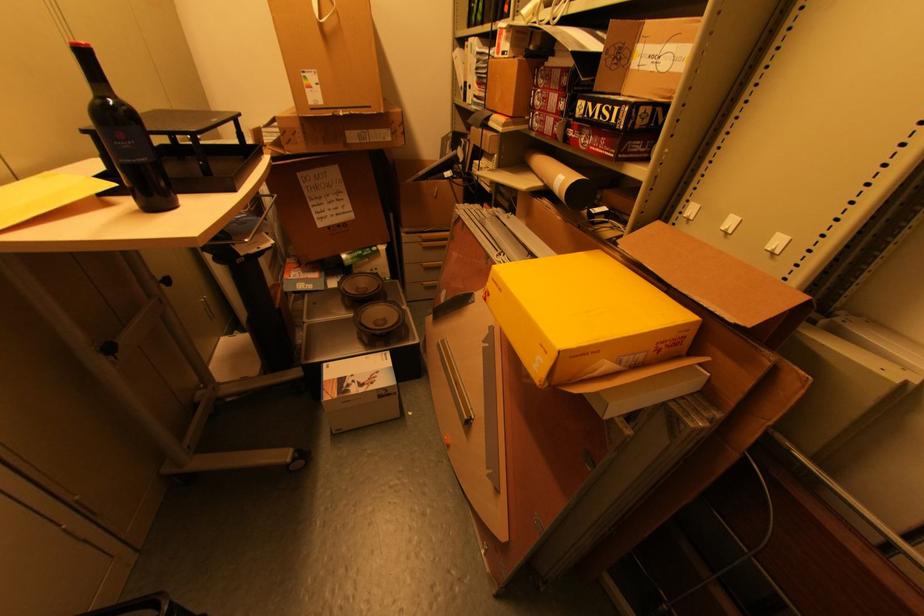
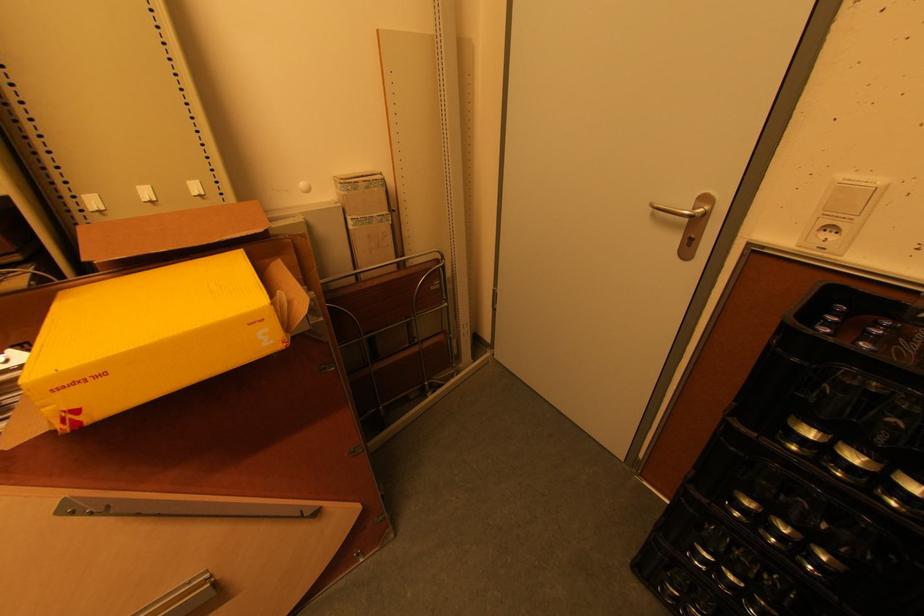
First-person continuous shooting, in which direction is the camera rotating?

The camera's rotation is toward right-down.